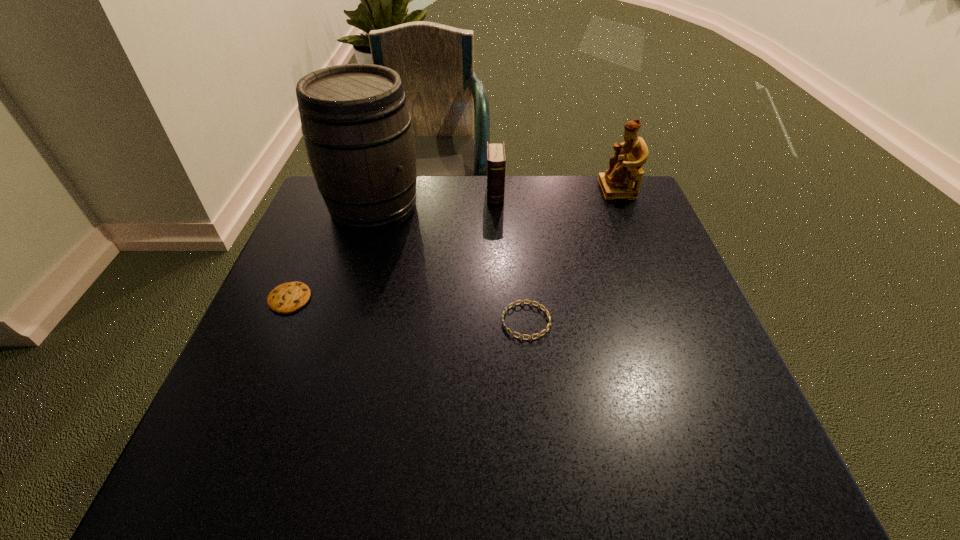
You are a GUI agent. You are given a task and a screenshot of the screen. Output one action in this format:
    pyautogui.click(x=<x>, y=<y>)
    Task: Click on the vacant area that lies between the diary and the tallest object
    
    Given the screenshot: What is the action you would take?
    pyautogui.click(x=434, y=201)

Image resolution: width=960 pixels, height=540 pixels. Find the location of `empty space between the bracelet and the wine bucket`. empty space between the bracelet and the wine bucket is located at coordinates (450, 264).

This screenshot has width=960, height=540. In order to click on free space between the cookie and the bracelet in this screenshot , I will do `click(408, 310)`.

Find the location of a particular element. empty space that is in between the rightmost object and the cookie is located at coordinates (453, 244).

At what (x,y) coordinates should I click in order to perform the action: click on unoccupied position between the cookie and the bracelet. Please return your answer as a coordinate pair (x, y). The image size is (960, 540). Looking at the image, I should click on (408, 310).

The image size is (960, 540). I want to click on vacant point located between the cookie and the figurine, so click(453, 244).

Find the location of a particular element. This screenshot has width=960, height=540. vacant area that lies between the cookie and the diary is located at coordinates (392, 247).

The image size is (960, 540). I want to click on empty space between the wine bucket and the third tallest object, so click(x=434, y=201).

This screenshot has height=540, width=960. What are the coordinates of `object that is the third closest to the bracelet` in the screenshot? It's located at (286, 298).

This screenshot has height=540, width=960. I want to click on object that ranks as the fourth closest to the cookie, so click(618, 182).